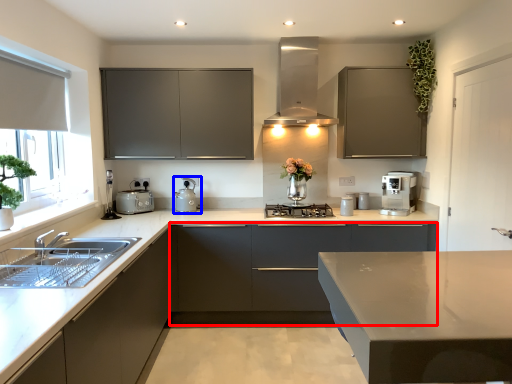
Question: Which point is closer to the camera, cabinetry (highlighted by a red box) or appliance (highlighted by a blue box)?

Choices:
 (A) cabinetry
 (B) appliance

Answer: (A)